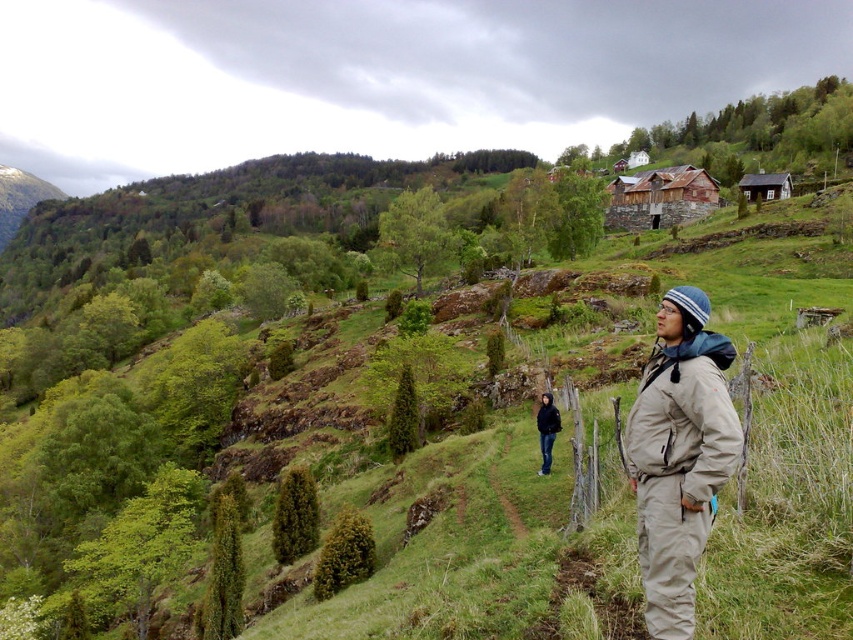
Question: Can you confirm if green grassy hillside at center is positioned above dark blue jacket at center?

Choices:
 (A) yes
 (B) no

Answer: (B)

Question: Among these objects, which one is farthest from the camera?

Choices:
 (A) dark blue jacket at center
 (B) khaki fleece jacket at center

Answer: (A)

Question: Which point appears closest to the camera in this image?

Choices:
 (A) (62, 502)
 (B) (682, 376)

Answer: (B)

Question: Which object is farther from the camera taking this photo?

Choices:
 (A) dark blue jacket at center
 (B) green grassy hillside at center
 (C) khaki fleece jacket at center

Answer: (A)

Question: Can you confirm if green grassy hillside at center is smaller than khaki fleece jacket at center?

Choices:
 (A) no
 (B) yes

Answer: (A)

Question: Does khaki fleece jacket at center appear under dark blue jacket at center?

Choices:
 (A) no
 (B) yes

Answer: (A)